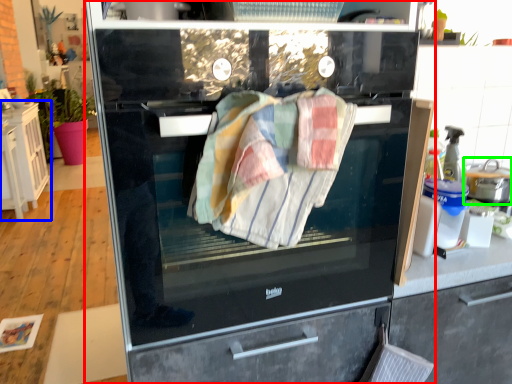
Question: Which is farther away from home appliance (highlighted by a red box)? cabinetry (highlighted by a blue box) or kitchen appliance (highlighted by a green box)?

Choices:
 (A) cabinetry
 (B) kitchen appliance

Answer: (A)